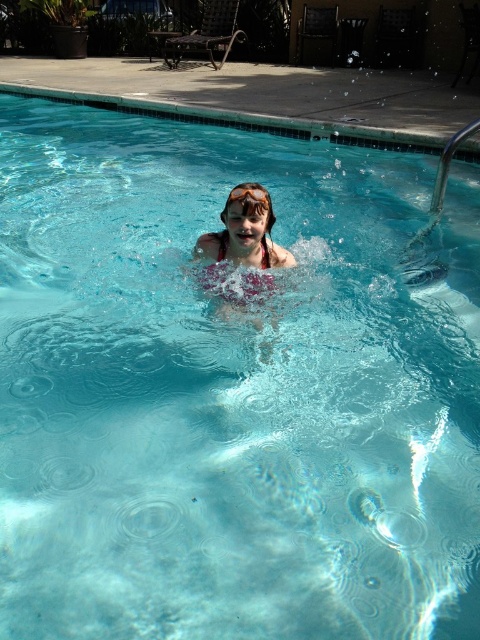
Does pink fabric swim cap at center appear on the right side of orange rubber goggles at center?

Incorrect, pink fabric swim cap at center is not on the right side of orange rubber goggles at center.

Is point (255, 262) farther from viewer compared to point (244, 195)?

Yes, it is behind point (244, 195).

Where is `pink fabric swim cap at center`? pink fabric swim cap at center is located at coordinates (244, 237).